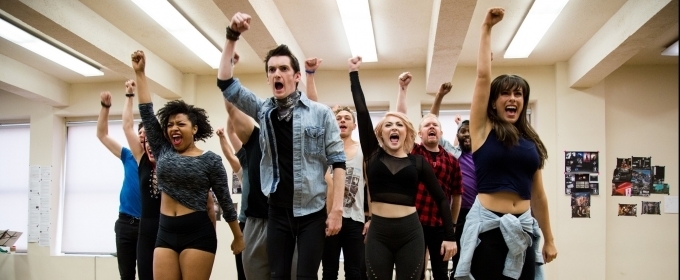
Where is `curtains/blinds`? curtains/blinds is located at coordinates (1, 178), (75, 177).